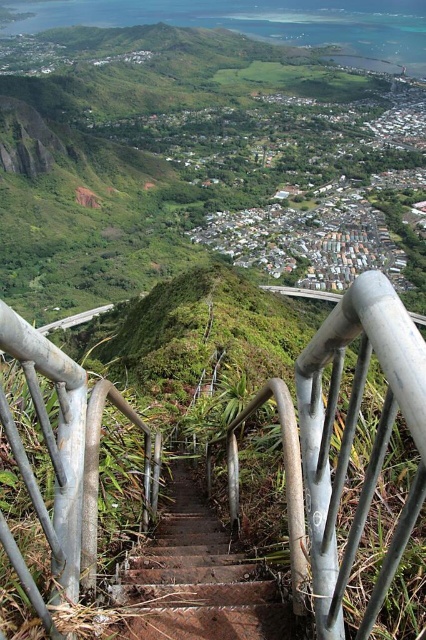
Consider the image. Is silver metallic rail at center positioned behind rusty metal stairs at center?

No, it is not.

Which is behind, point (419, 396) or point (215, 628)?

Positioned behind is point (215, 628).

Is point (58, 406) positioned after point (154, 604)?

Yes.

Locate an element on the screen. This screenshot has width=426, height=640. silver metallic rail at center is located at coordinates (344, 444).